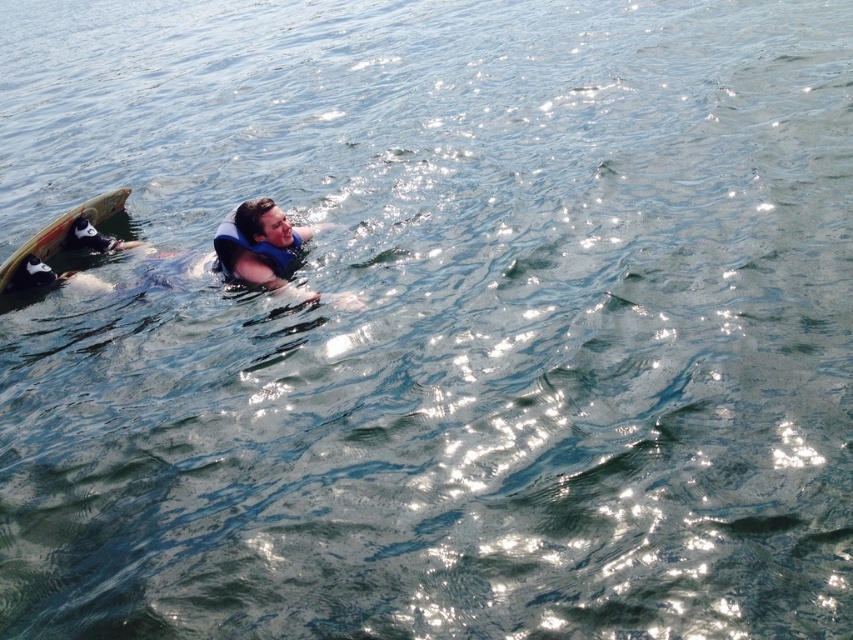
You are a photographer taking a picture of the water surface. You notice two points marked as point (x=242, y=241) and point (x=283, y=266). Which point is closer to your camera lens?

Point (x=242, y=241) is closer to the viewer than point (x=283, y=266), so it is the point closer to the camera lens.

You are a lifeguard on duty and notice two flotation devices in the water. One is the blue life vest at center and the other is the blue fabric life jacket at center. Which one has a larger size?

The blue life vest at center is bigger than the blue fabric life jacket at center, so the blue life vest at center has a larger size.

You are a lifeguard observing the scene from a tower. You notice a point at coordinates (253, 240) in the image. What object is located at that point?

The point at coordinates (253, 240) corresponds to the blue fabric life jacket at center.